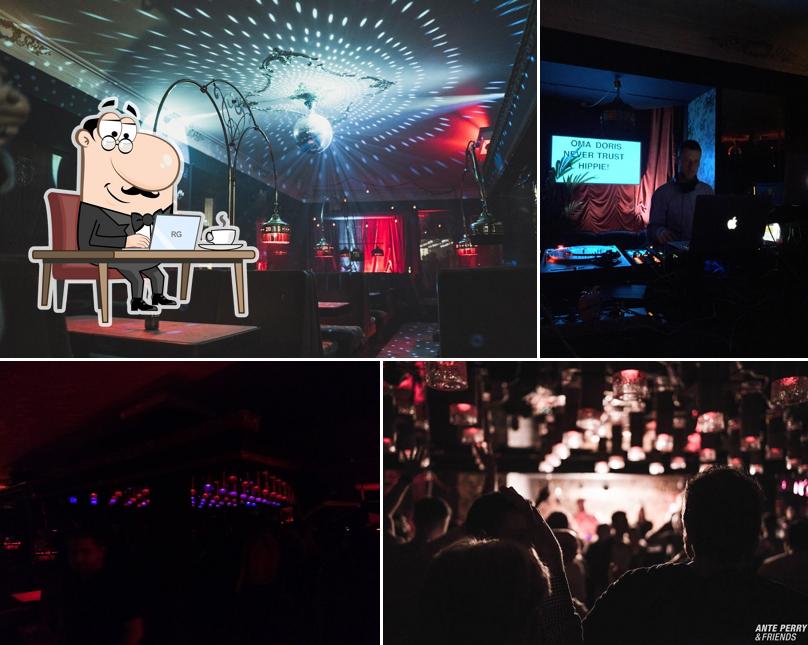
The image size is (808, 645). I want to click on disco ball, so pos(312,135).